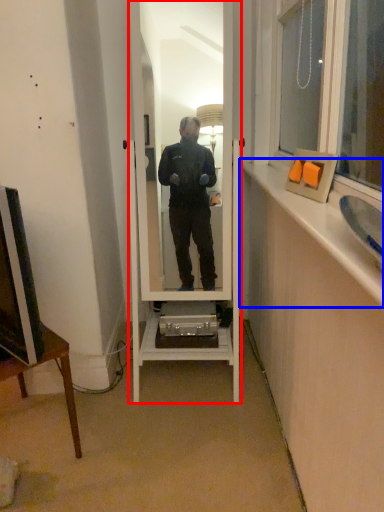
Question: Among these objects, which one is farthest to the camera, mirror (highlighted by a red box) or window sill (highlighted by a blue box)?

Choices:
 (A) mirror
 (B) window sill

Answer: (A)